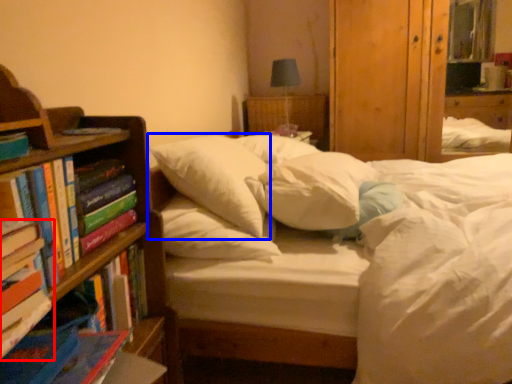
Question: Which of the following is the farthest to the observer, book (highlighted by a red box) or pillow (highlighted by a blue box)?

Choices:
 (A) book
 (B) pillow

Answer: (B)